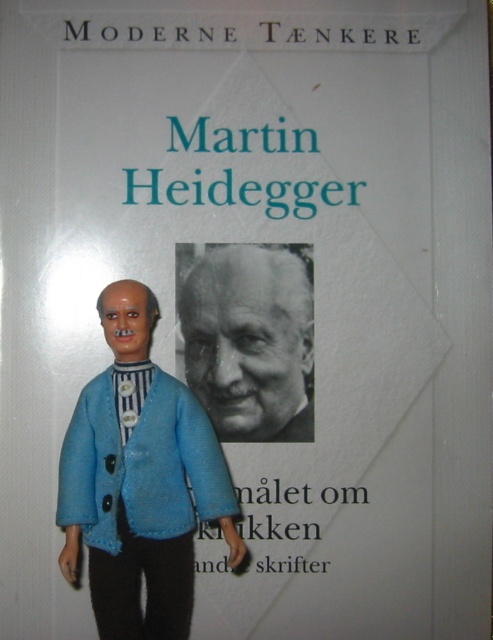
Question: Does blue fabric doll at center lie in front of black and white photograph of martin heidegger at center?

Choices:
 (A) no
 (B) yes

Answer: (B)

Question: Which point is closer to the camera taking this photo?

Choices:
 (A) (203, 324)
 (B) (121, 572)

Answer: (B)

Question: Does blue fabric doll at center appear under black and white photograph of martin heidegger at center?

Choices:
 (A) yes
 (B) no

Answer: (A)

Question: Among these points, which one is farthest from the camera?

Choices:
 (A) (255, 262)
 (B) (168, 484)

Answer: (A)

Question: Is blue fabric doll at center positioned behind black and white photograph of martin heidegger at center?

Choices:
 (A) yes
 (B) no

Answer: (B)